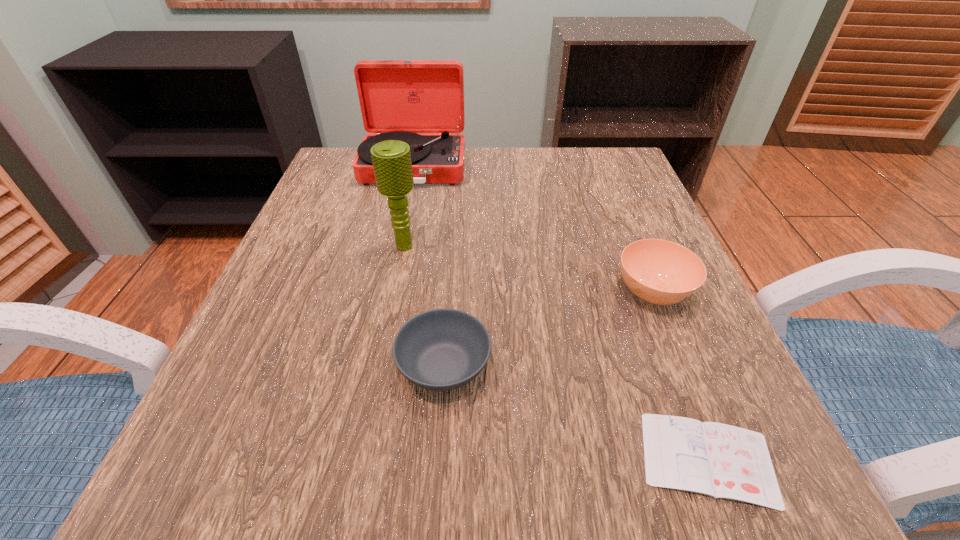
Where is `vacant space that satisfies the following two spatial constraints: 1. on the front-facing side of the fourth tallest object; 2. on the left side of the phonograph_record`? vacant space that satisfies the following two spatial constraints: 1. on the front-facing side of the fourth tallest object; 2. on the left side of the phonograph_record is located at coordinates (370, 366).

Locate an element on the screen. This screenshot has width=960, height=540. vacant space that satisfies the following two spatial constraints: 1. on the front-facing side of the second shortest object; 2. on the right side of the phonograph_record is located at coordinates (370, 366).

Locate an element on the screen. vacant position in the image that satisfies the following two spatial constraints: 1. on the back side of the shortest object; 2. on the right side of the third farthest object is located at coordinates (644, 292).

You are a GUI agent. You are given a task and a screenshot of the screen. Output one action in this format:
    pyautogui.click(x=<x>, y=<y>)
    Task: Click on the free point that satisfies the following two spatial constraints: 1. on the front-facing side of the shorter soup bowl; 2. on the left side of the farthest object
    
    Given the screenshot: What is the action you would take?
    pyautogui.click(x=370, y=366)